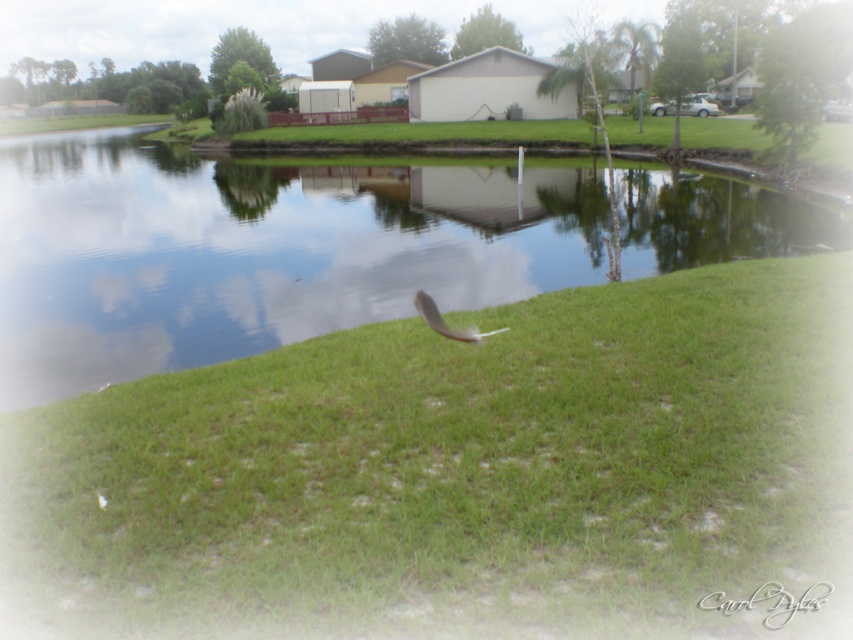
Question: Is transparent glass water at center bigger than white feather at center?

Choices:
 (A) yes
 (B) no

Answer: (A)

Question: Which point is closer to the camera taking this photo?

Choices:
 (A) (799, 252)
 (B) (498, 330)

Answer: (B)

Question: Which point is closer to the camera?

Choices:
 (A) (502, 330)
 (B) (352, 356)
 (C) (53, 209)

Answer: (B)

Question: Which point appears farthest from the camera in this image?

Choices:
 (A) (6, 189)
 (B) (463, 337)

Answer: (A)

Question: Does green grass at center have a greater width compared to white feather at center?

Choices:
 (A) no
 (B) yes

Answer: (B)

Question: Can you confirm if green grass at center is positioned to the right of transparent glass water at center?

Choices:
 (A) no
 (B) yes

Answer: (B)